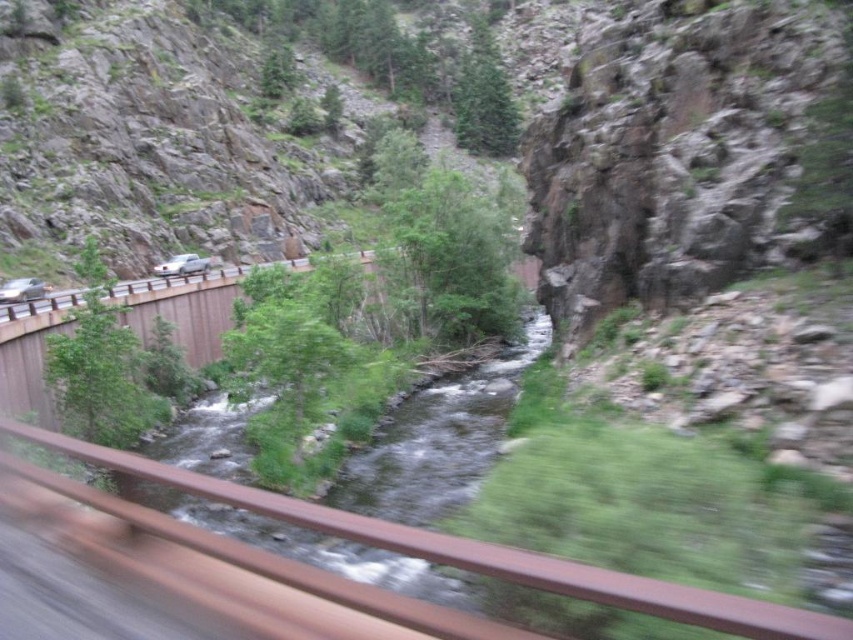
Question: Is green grassy river at center above rusty metal train track at center?

Choices:
 (A) yes
 (B) no

Answer: (A)

Question: Considering the relative positions of green grassy river at center and rusty metal train track at center in the image provided, where is green grassy river at center located with respect to rusty metal train track at center?

Choices:
 (A) below
 (B) above

Answer: (B)

Question: Is green grassy river at center bigger than rusty metal train track at center?

Choices:
 (A) yes
 (B) no

Answer: (A)

Question: Which point is closer to the camera?

Choices:
 (A) rusty metal train track at center
 (B) green grassy river at center

Answer: (A)

Question: Which point is farther to the camera?

Choices:
 (A) green grassy river at center
 (B) rusty metal train track at center

Answer: (A)

Question: Which object appears farthest from the camera in this image?

Choices:
 (A) green grassy river at center
 (B) rusty metal train track at center

Answer: (A)